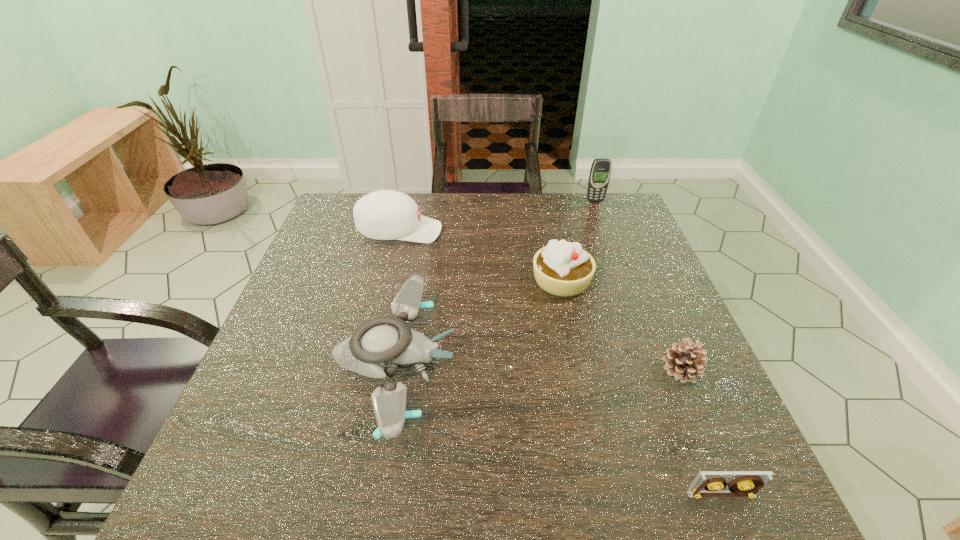
You are a GUI agent. You are given a task and a screenshot of the screen. Output one action in this format:
    pyautogui.click(x=<x>, y=<y>)
    Task: Click on the cellular telephone
    This screenshot has width=960, height=540.
    Given the screenshot: What is the action you would take?
    pyautogui.click(x=600, y=171)

You are a GUI agent. You are given a task and a screenshot of the screen. Output one action in this format:
    pyautogui.click(x=<x>, y=<y>)
    Task: Click on the baseball cap
    The height and width of the screenshot is (540, 960).
    Given the screenshot: What is the action you would take?
    pyautogui.click(x=386, y=214)

Find the location of `the third object from left to right`. the third object from left to right is located at coordinates (564, 269).

Image resolution: width=960 pixels, height=540 pixels. What are the coordinates of `pinecone` in the screenshot? It's located at (684, 361).

Find the location of a particular element. Image resolution: width=960 pixels, height=540 pixels. drone is located at coordinates (378, 348).

In order to click on videotape in this screenshot , I will do `click(745, 483)`.

This screenshot has width=960, height=540. What are the coordinates of `the shortest object` in the screenshot? It's located at (745, 483).

At what (x,y) coordinates should I click in order to perform the action: click on free space located on the screen of the farthest object. Please return your answer as a coordinate pair (x, y). The width and height of the screenshot is (960, 540). Looking at the image, I should click on (610, 239).

This screenshot has width=960, height=540. In order to click on vacant space situated on the front-facing side of the baseball cap in this screenshot , I will do `click(565, 231)`.

Where is `free location located 0.290m on the back of the fourth object from right to left`? free location located 0.290m on the back of the fourth object from right to left is located at coordinates (545, 205).